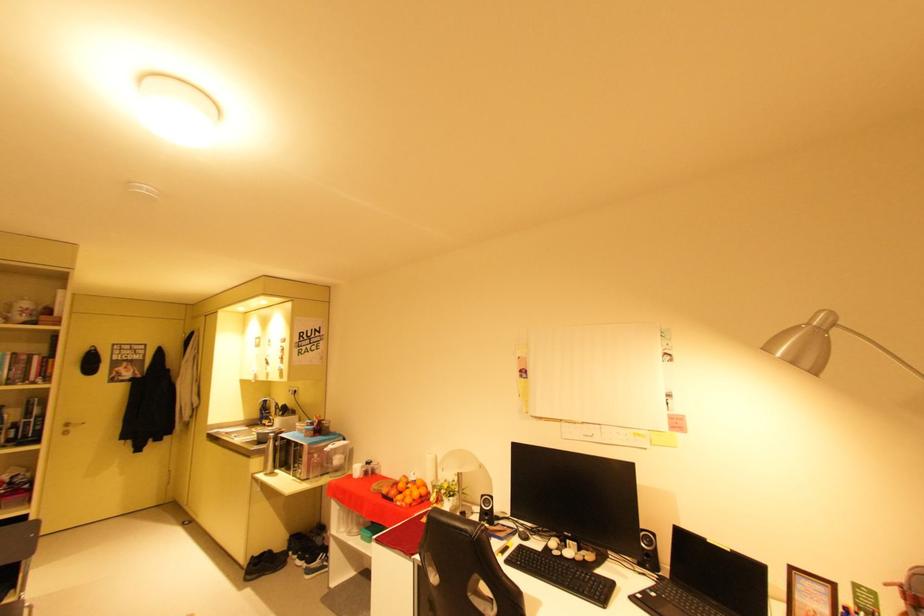
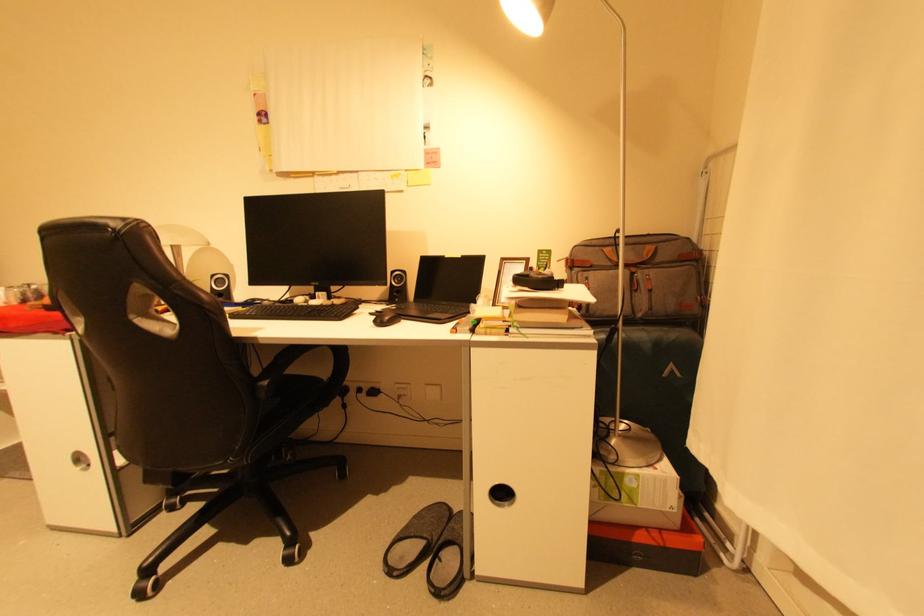
First-person continuous shooting, in which direction is the camera rotating?

The camera's rotation is toward right-down.